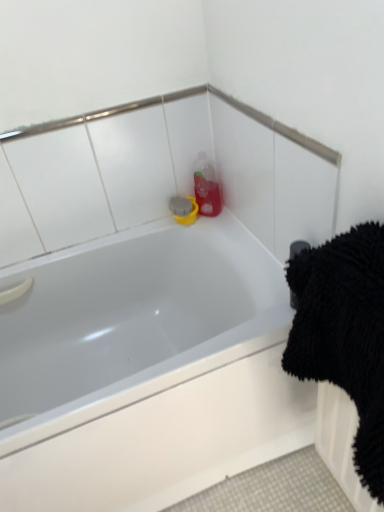
Question: Can you confirm if black rubber towel bar at upper right is thinner than black fluffy bath towel at right?

Choices:
 (A) no
 (B) yes

Answer: (B)

Question: Is black rubber towel bar at upper right closer to the viewer compared to black fluffy bath towel at right?

Choices:
 (A) yes
 (B) no

Answer: (B)

Question: From the image's perspective, is black rubber towel bar at upper right located above black fluffy bath towel at right?

Choices:
 (A) no
 (B) yes

Answer: (B)

Question: Does black rubber towel bar at upper right appear on the right side of black fluffy bath towel at right?

Choices:
 (A) no
 (B) yes

Answer: (A)

Question: Does black rubber towel bar at upper right have a lesser height compared to black fluffy bath towel at right?

Choices:
 (A) yes
 (B) no

Answer: (A)

Question: From a real-world perspective, is black rubber towel bar at upper right beneath black fluffy bath towel at right?

Choices:
 (A) yes
 (B) no

Answer: (B)

Question: From the image's perspective, does white glossy bathtub at upper center appear lower than black rubber towel bar at upper right?

Choices:
 (A) no
 (B) yes

Answer: (B)

Question: Does white glossy bathtub at upper center appear on the right side of black rubber towel bar at upper right?

Choices:
 (A) no
 (B) yes

Answer: (A)

Question: Considering the relative sizes of white glossy bathtub at upper center and black rubber towel bar at upper right in the image provided, is white glossy bathtub at upper center taller than black rubber towel bar at upper right?

Choices:
 (A) yes
 (B) no

Answer: (A)

Question: Considering the relative sizes of white glossy bathtub at upper center and black rubber towel bar at upper right in the image provided, is white glossy bathtub at upper center bigger than black rubber towel bar at upper right?

Choices:
 (A) no
 (B) yes

Answer: (B)

Question: From a real-world perspective, does white glossy bathtub at upper center stand above black rubber towel bar at upper right?

Choices:
 (A) no
 (B) yes

Answer: (A)

Question: Does white glossy bathtub at upper center have a greater width compared to black rubber towel bar at upper right?

Choices:
 (A) yes
 (B) no

Answer: (A)

Question: Is black rubber towel bar at upper right shorter than white glossy bathtub at upper center?

Choices:
 (A) yes
 (B) no

Answer: (A)